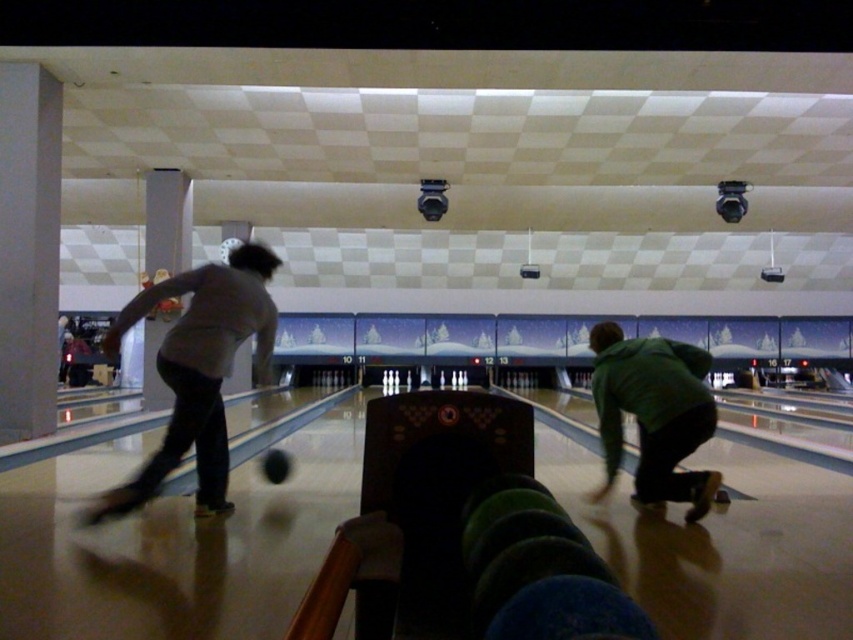
Question: Which of these objects is positioned farthest from the shiny black bowling ball at center?

Choices:
 (A) gray fabric shirt at left
 (B) green matte jacket at lower right

Answer: (B)

Question: Does gray fabric shirt at left have a greater width compared to shiny black bowling ball at center?

Choices:
 (A) no
 (B) yes

Answer: (B)

Question: Can you confirm if gray fabric shirt at left is positioned above green matte jacket at lower right?

Choices:
 (A) yes
 (B) no

Answer: (A)

Question: Considering the real-world distances, which object is farthest from the gray fabric shirt at left?

Choices:
 (A) shiny black bowling ball at center
 (B) green matte jacket at lower right

Answer: (B)

Question: Is gray fabric shirt at left thinner than shiny black bowling ball at center?

Choices:
 (A) yes
 (B) no

Answer: (B)

Question: Which of these objects is positioned farthest from the green matte jacket at lower right?

Choices:
 (A) gray fabric shirt at left
 (B) shiny black bowling ball at center

Answer: (B)